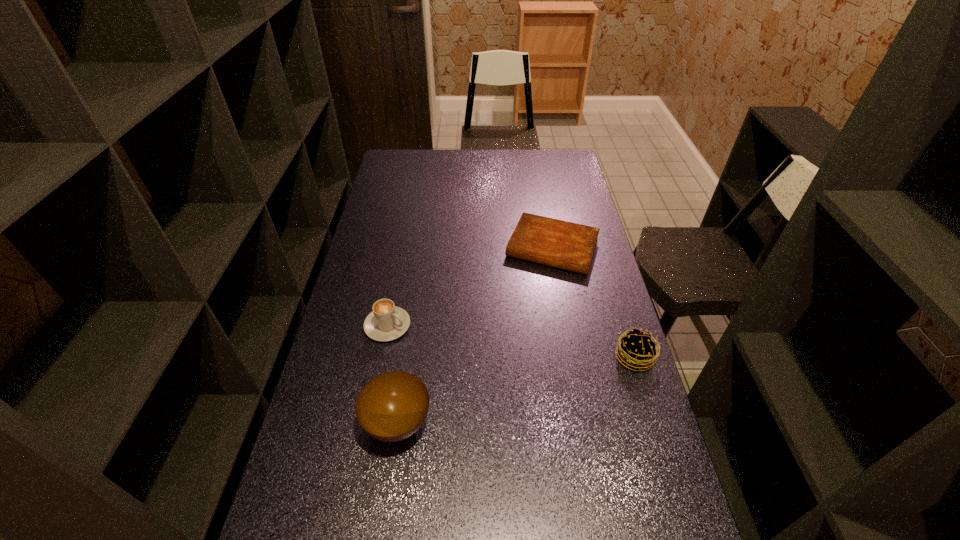
Locate an element on the screen. The width and height of the screenshot is (960, 540). bowl is located at coordinates (391, 407).

Find the location of a particular element. patty is located at coordinates (637, 349).

Image resolution: width=960 pixels, height=540 pixels. I want to click on the farthest object, so click(570, 246).

I want to click on Bible, so click(x=570, y=246).

The width and height of the screenshot is (960, 540). I want to click on cappuccino, so click(386, 322).

You are a GUI agent. You are given a task and a screenshot of the screen. Output one action in this format:
    pyautogui.click(x=<x>, y=<y>)
    Task: Click on the vacant space located 0.280m on the right of the nearest object
    The image size is (960, 540).
    Given the screenshot: What is the action you would take?
    pyautogui.click(x=540, y=423)

This screenshot has width=960, height=540. I want to click on vacant space located 0.220m on the front of the patty, so click(662, 448).

The width and height of the screenshot is (960, 540). What are the coordinates of `vacant space situated 0.110m on the spine side of the Bible` in the screenshot? It's located at (531, 296).

The width and height of the screenshot is (960, 540). Find the location of `free space located 0.360m on the spine side of the Bible`. free space located 0.360m on the spine side of the Bible is located at coordinates (509, 354).

Locate an element on the screen. This screenshot has width=960, height=540. vacant space located 0.110m on the spine side of the Bible is located at coordinates (531, 296).